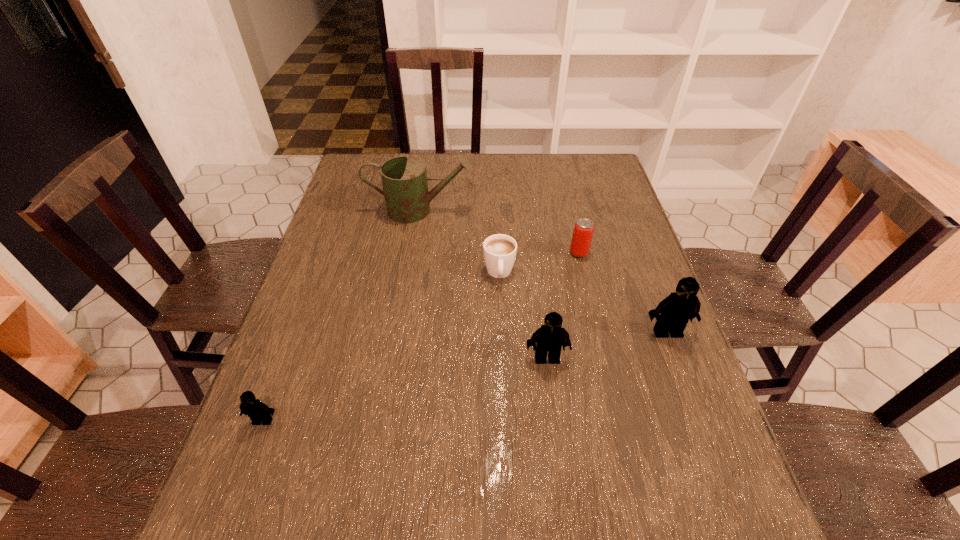
Identify the location of free space located 0.060m on the face of the nearest Lego. (250, 456).

Locate an element on the screen. The image size is (960, 540). free spot located on the face of the second tallest Lego is located at coordinates (562, 475).

At what (x,y) coordinates should I click in order to perform the action: click on vacant area situated 0.130m on the face of the third nearest object. Please return your answer as a coordinate pair (x, y). This screenshot has width=960, height=540. Looking at the image, I should click on (688, 388).

You are a GUI agent. You are given a task and a screenshot of the screen. Output one action in this format:
    pyautogui.click(x=<x>, y=<y>)
    Task: Click on the blank area located 0.310m with the spout on the watering can
    The width and height of the screenshot is (960, 540).
    Given the screenshot: What is the action you would take?
    pyautogui.click(x=572, y=210)

Find the location of a particular element. blank space located on the back of the fifth object from left to right is located at coordinates (565, 196).

This screenshot has width=960, height=540. What are the coordinates of `vacant space situated with the handle on the side of the cappuccino` in the screenshot? It's located at pos(504,379).

Identify the location of Lego situated at the left edge. (258, 412).

Image resolution: width=960 pixels, height=540 pixels. In order to click on watering can positioned at the left edge in this screenshot , I will do `click(404, 179)`.

The height and width of the screenshot is (540, 960). I want to click on Lego situated at the right edge, so click(x=672, y=314).

Find the location of a particular element. The image size is (960, 540). beer can that is positioned at the right edge is located at coordinates (583, 230).